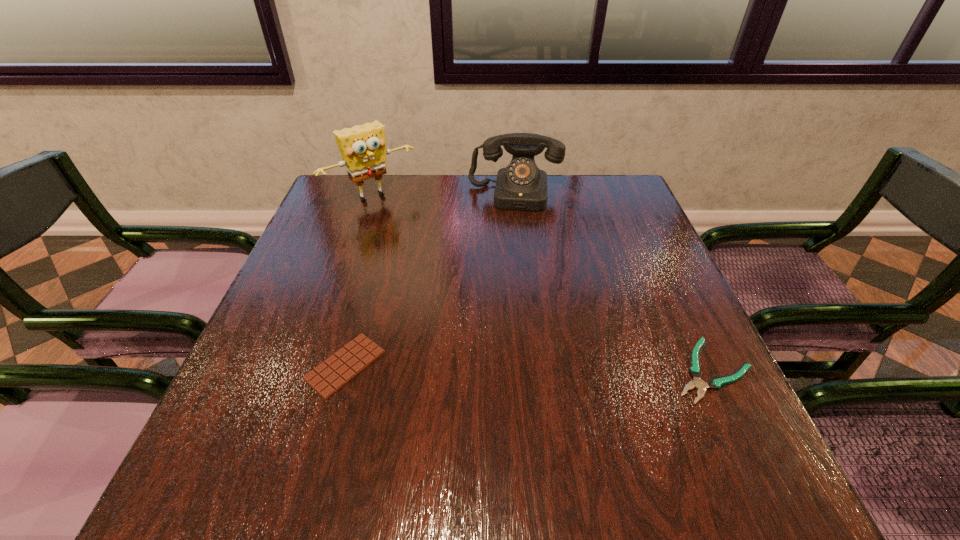
Image resolution: width=960 pixels, height=540 pixels. Identify the location of blank area in the image that satisfies the following two spatial constraints: 1. on the front side of the sponge; 2. on the left side of the rightmost object. (314, 371).

This screenshot has width=960, height=540. I want to click on free space that satisfies the following two spatial constraints: 1. on the front side of the second object from right to left; 2. on the right side of the rightmost object, so click(536, 371).

The image size is (960, 540). I want to click on free spot that satisfies the following two spatial constraints: 1. on the front side of the rightmost object; 2. on the left side of the telephone, so click(536, 371).